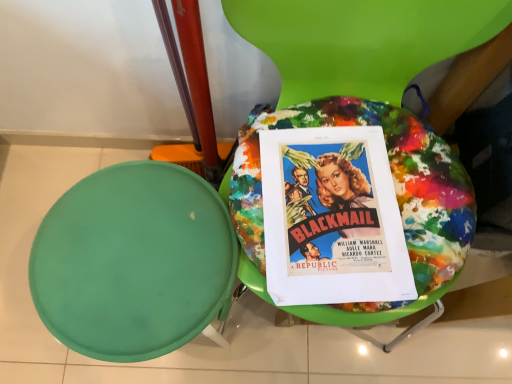
Question: Is green matte stool at left further to the viewer compared to paint splattered fabric cushion at center?

Choices:
 (A) no
 (B) yes

Answer: (B)

Question: Can you confirm if green matte stool at left is positioned to the right of paint splattered fabric cushion at center?

Choices:
 (A) no
 (B) yes

Answer: (A)

Question: From the image's perspective, does green matte stool at left appear higher than paint splattered fabric cushion at center?

Choices:
 (A) yes
 (B) no

Answer: (B)

Question: Considering the relative sizes of green matte stool at left and paint splattered fabric cushion at center in the image provided, is green matte stool at left bigger than paint splattered fabric cushion at center?

Choices:
 (A) no
 (B) yes

Answer: (A)

Question: From a real-world perspective, is green matte stool at left located beneath paint splattered fabric cushion at center?

Choices:
 (A) yes
 (B) no

Answer: (A)

Question: Is the position of green matte stool at left less distant than that of paint splattered fabric cushion at center?

Choices:
 (A) no
 (B) yes

Answer: (A)

Question: Is green matte stool at left outside vibrant paper poster at center?

Choices:
 (A) yes
 (B) no

Answer: (A)

Question: Is green matte stool at left thinner than vibrant paper poster at center?

Choices:
 (A) yes
 (B) no

Answer: (B)

Question: Is green matte stool at left oriented towards vibrant paper poster at center?

Choices:
 (A) no
 (B) yes

Answer: (A)

Question: Is vibrant paper poster at center surrounded by green matte stool at left?

Choices:
 (A) no
 (B) yes

Answer: (A)

Question: Does green matte stool at left have a smaller size compared to vibrant paper poster at center?

Choices:
 (A) yes
 (B) no

Answer: (B)

Question: From the image's perspective, is green matte stool at left above vibrant paper poster at center?

Choices:
 (A) yes
 (B) no

Answer: (B)

Question: Is vibrant paper poster at center placed right next to green matte stool at left?

Choices:
 (A) yes
 (B) no

Answer: (B)